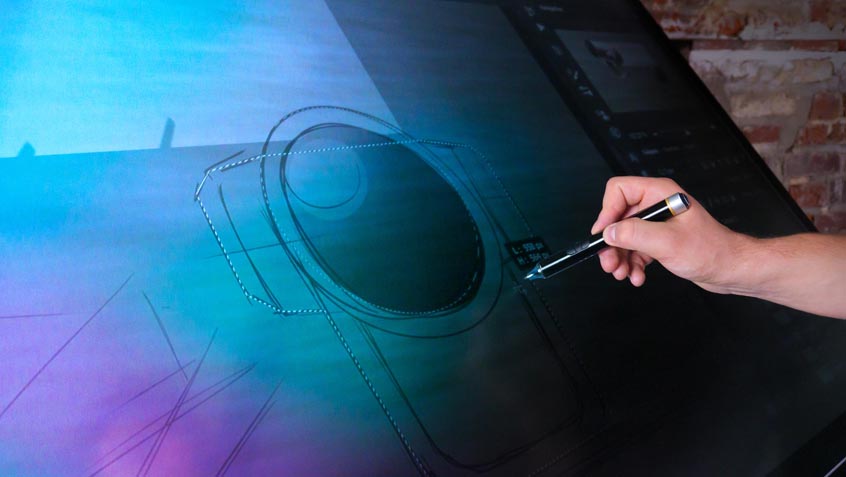
Find the location of `screen`. screen is located at coordinates (682, 402).